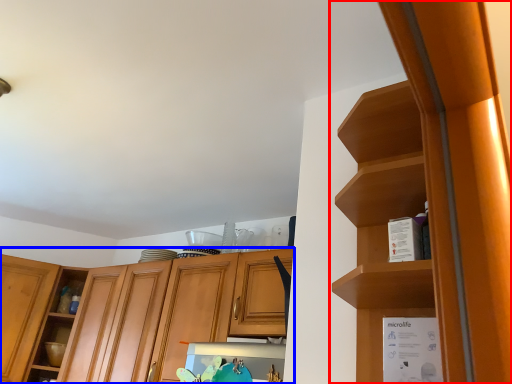
Question: Among these objects, which one is nearest to the camera, cabinetry (highlighted by a red box) or cabinetry (highlighted by a blue box)?

Choices:
 (A) cabinetry
 (B) cabinetry

Answer: (A)